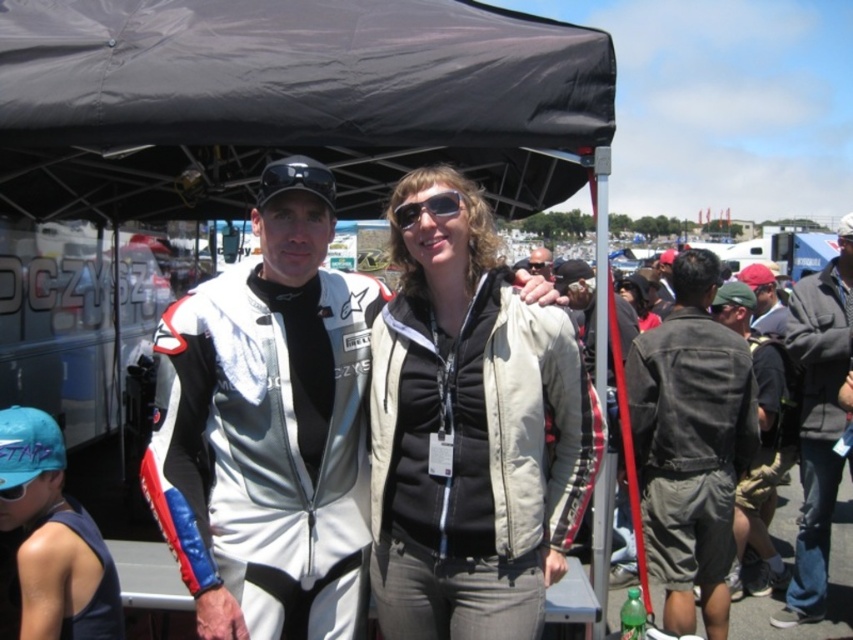
Who is more distant from viewer, (256, 77) or (396, 522)?

The point (256, 77) is more distant.

Is point (310, 77) closer to viewer compared to point (543, 538)?

No.

This screenshot has height=640, width=853. Find the location of `black fabric tent at upper center`. black fabric tent at upper center is located at coordinates (289, 100).

Does denim jacket at center appear over blue fabric cap at lower left?

Yes.

The height and width of the screenshot is (640, 853). Find the location of `denim jacket at center`. denim jacket at center is located at coordinates (691, 444).

The image size is (853, 640). Identify the location of denim jacket at center. (691, 444).

Is point (503, 216) more distant than point (229, 86)?

Yes, it is.

Between black fabric tent at upper center and black fabric canopy at upper center, which one is positioned higher?

black fabric canopy at upper center

Between point (577, 168) and point (613, 108), which one is positioned in front?

Point (613, 108) is more forward.

This screenshot has height=640, width=853. I want to click on black fabric tent at upper center, so click(289, 100).